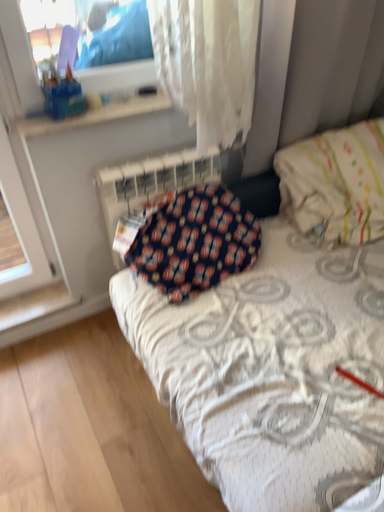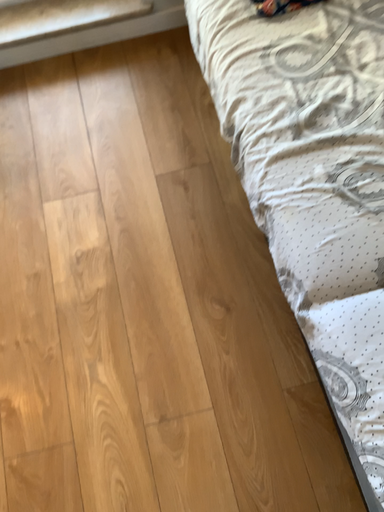
Question: How did the camera likely rotate when shooting the video?

Choices:
 (A) rotated left
 (B) rotated right

Answer: (A)